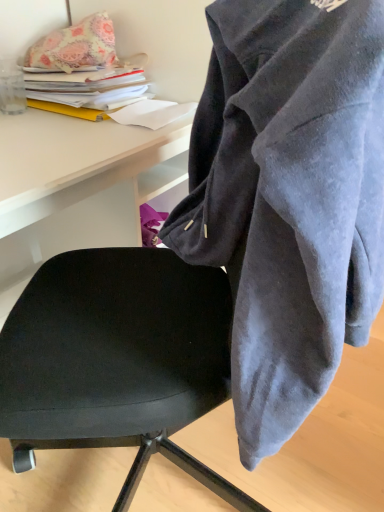
Question: Considering the relative positions of black leather chair at center and floral fabric pillow at upper left in the image provided, is black leather chair at center to the right of floral fabric pillow at upper left from the viewer's perspective?

Choices:
 (A) no
 (B) yes

Answer: (A)

Question: From the image's perspective, is black leather chair at center above floral fabric pillow at upper left?

Choices:
 (A) yes
 (B) no

Answer: (B)

Question: Is black leather chair at center smaller than floral fabric pillow at upper left?

Choices:
 (A) no
 (B) yes

Answer: (A)

Question: Is black leather chair at center oriented towards floral fabric pillow at upper left?

Choices:
 (A) no
 (B) yes

Answer: (A)

Question: Does black leather chair at center have a larger size compared to floral fabric pillow at upper left?

Choices:
 (A) no
 (B) yes

Answer: (B)

Question: Considering the positions of point (382, 58) and point (33, 301), is point (382, 58) closer or farther from the camera than point (33, 301)?

Choices:
 (A) farther
 (B) closer

Answer: (B)

Question: From a real-world perspective, is velvet gray hoodie at center above or below black leather chair at center?

Choices:
 (A) above
 (B) below

Answer: (A)

Question: Is velvet gray hoodie at center to the left or to the right of black leather chair at center in the image?

Choices:
 (A) right
 (B) left

Answer: (A)

Question: From the image's perspective, is velvet gray hoodie at center above or below black leather chair at center?

Choices:
 (A) above
 (B) below

Answer: (A)

Question: Is black leather chair at center in front of or behind floral fabric pillow at upper left in the image?

Choices:
 (A) front
 (B) behind

Answer: (A)

Question: Would you say black leather chair at center is inside or outside floral fabric pillow at upper left?

Choices:
 (A) outside
 (B) inside

Answer: (A)

Question: From their relative heights in the image, would you say black leather chair at center is taller or shorter than floral fabric pillow at upper left?

Choices:
 (A) tall
 (B) short

Answer: (A)

Question: Considering the positions of point [x=34, y=428] and point [x=74, y=68], is point [x=34, y=428] closer or farther from the camera than point [x=74, y=68]?

Choices:
 (A) farther
 (B) closer

Answer: (B)

Question: In the image, is velvet gray hoodie at center positioned in front of or behind floral fabric pillow at upper left?

Choices:
 (A) front
 (B) behind

Answer: (A)

Question: In terms of width, does velvet gray hoodie at center look wider or thinner when compared to floral fabric pillow at upper left?

Choices:
 (A) wide
 (B) thin

Answer: (A)